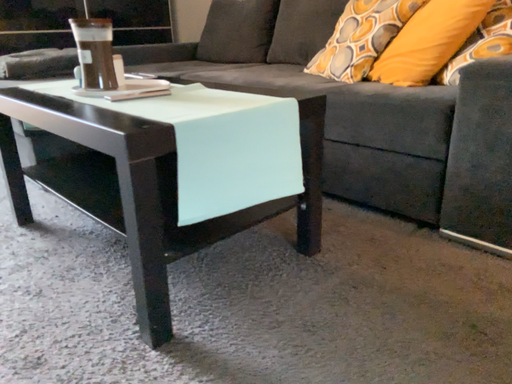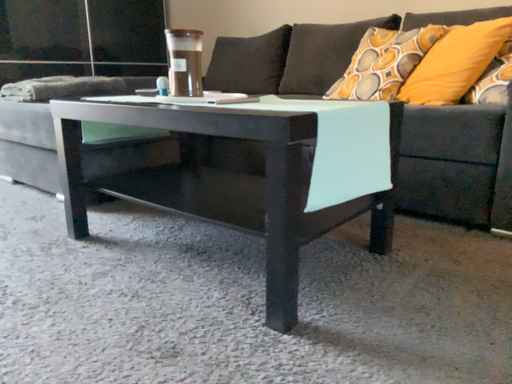
Question: How did the camera likely rotate when shooting the video?

Choices:
 (A) rotated downward
 (B) rotated upward

Answer: (B)